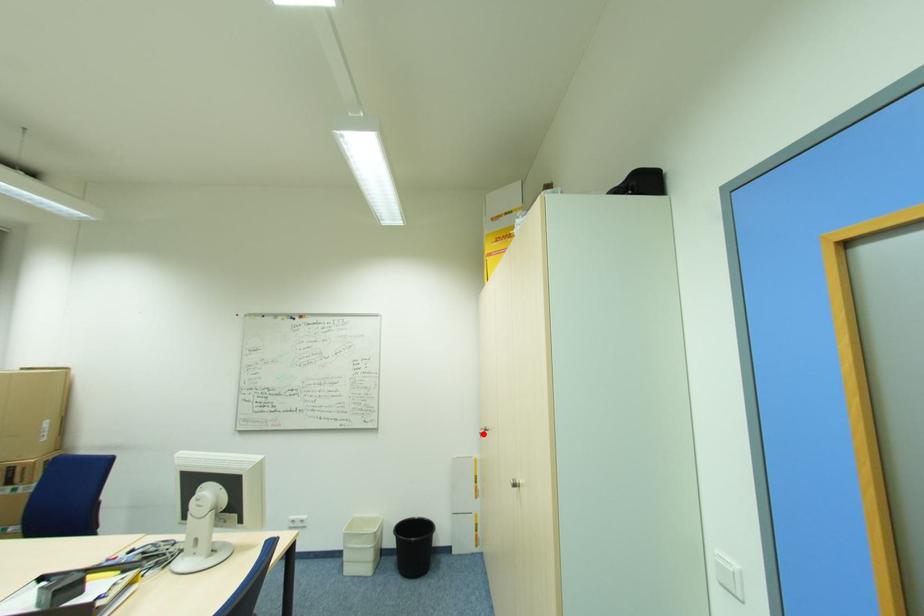
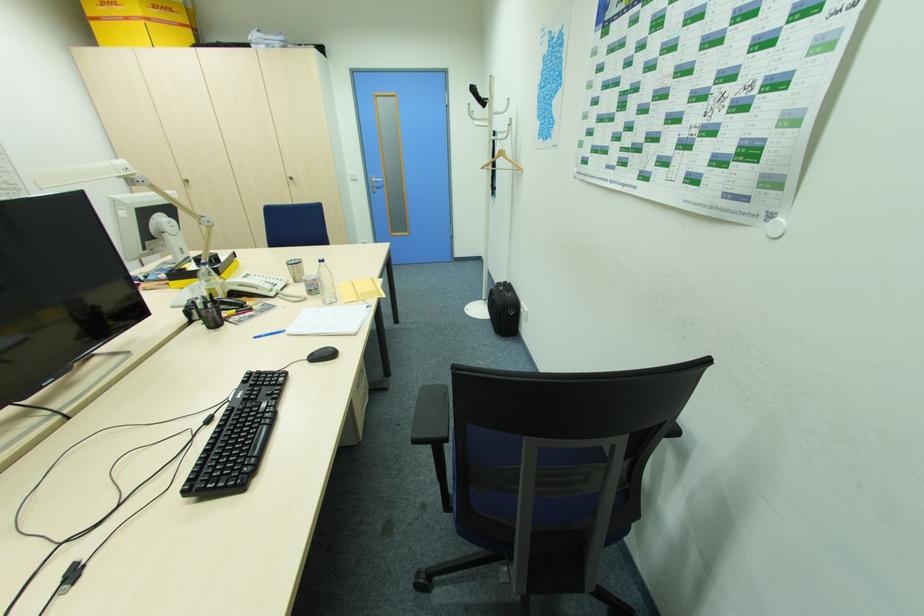
The point at the highlighted location is marked in the first image. Where is the corresponding point in the second image?

(188, 185)